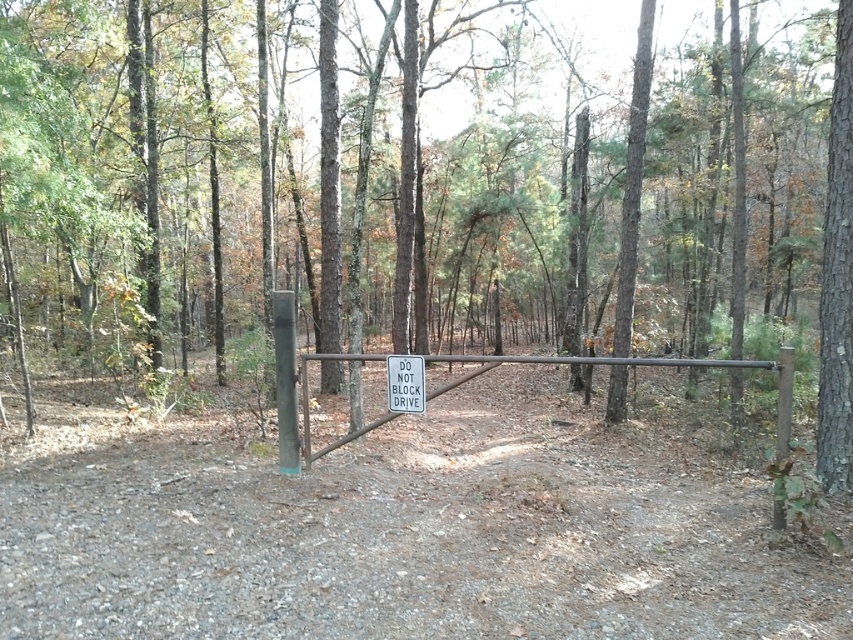
You are standing on the dirt path in the forest and see the smooth bark tree at right and the brown wooden gate at center. Which object is positioned to the right of the other?

The smooth bark tree at right is to the right of the brown wooden gate at center.

You are a hiker who wants to take a photo of the white plastic sign at center and the smooth bark tree at right. Which object should you focus on first if you want both to be in clear focus?

The smooth bark tree at right is further to the viewer than the white plastic sign at center, so you should focus on the smooth bark tree at right first to ensure both are in clear focus.